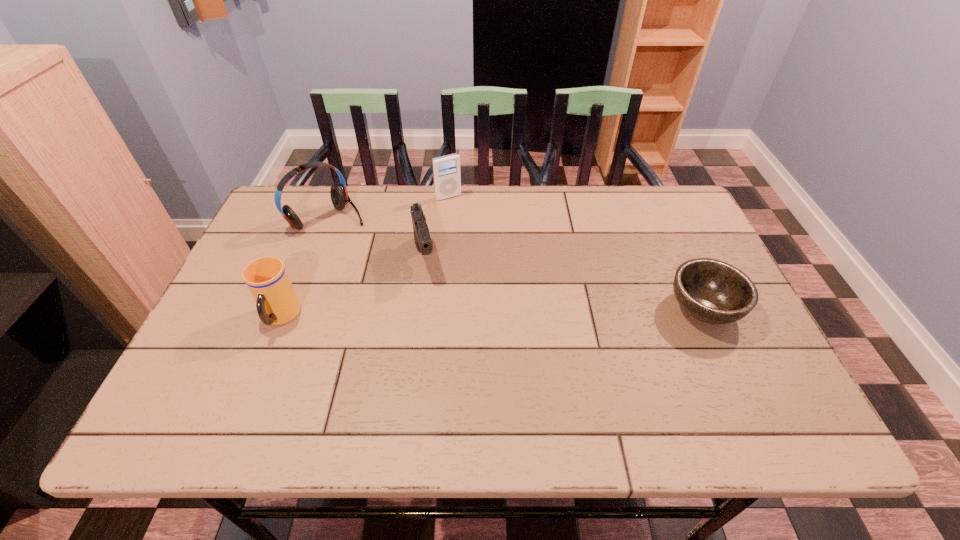
Image resolution: width=960 pixels, height=540 pixels. What are the coordinates of `cup` in the screenshot? It's located at (266, 278).

Locate an element on the screen. This screenshot has height=540, width=960. the rightmost object is located at coordinates (712, 291).

The width and height of the screenshot is (960, 540). In order to click on the shortest object in this screenshot , I will do `click(712, 291)`.

Where is `pistol`? The image size is (960, 540). pistol is located at coordinates (422, 238).

Find the location of a particular element. the tallest object is located at coordinates (338, 192).

Identify the location of the farthest object. This screenshot has height=540, width=960. (446, 169).

Where is `vacant space located on the side of the cup with the handle`? The width and height of the screenshot is (960, 540). vacant space located on the side of the cup with the handle is located at coordinates (251, 394).

You are a GUI agent. You are given a task and a screenshot of the screen. Output one action in this format:
    pyautogui.click(x=<x>, y=<y>)
    Task: Click on the vacant space located 0.320m on the back of the shortest object
    The width and height of the screenshot is (960, 540).
    Given the screenshot: What is the action you would take?
    pyautogui.click(x=657, y=206)

Find the location of a particular element. free spot located at the barrel of the pistol is located at coordinates (443, 349).

Where is `vacant space located 0.180m at the barrel of the pistol`? The height and width of the screenshot is (540, 960). vacant space located 0.180m at the barrel of the pistol is located at coordinates (439, 335).